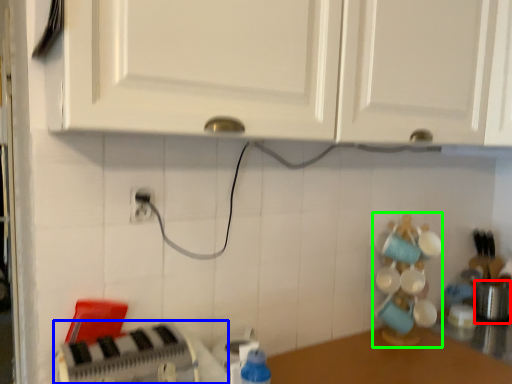
Question: Which is farther away from appliance (highlighted by a red box)? appliance (highlighted by a blue box) or toy (highlighted by a green box)?

Choices:
 (A) appliance
 (B) toy

Answer: (A)